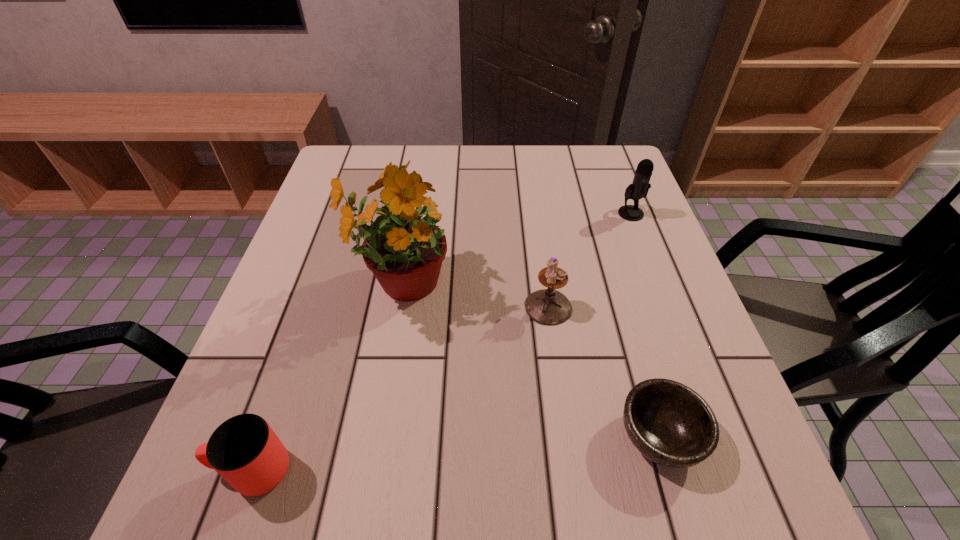
Where is `free space that satisfies the following two spatial constraints: 1. on the handle side of the leftmost object; 2. on the left side of the shortest object`? The image size is (960, 540). free space that satisfies the following two spatial constraints: 1. on the handle side of the leftmost object; 2. on the left side of the shortest object is located at coordinates (264, 436).

At what (x,y) coordinates should I click in order to perform the action: click on free location that satisfies the following two spatial constraints: 1. on the handle side of the candle holder; 2. on the left side of the cup. Please return your answer as a coordinate pair (x, y). Looking at the image, I should click on (309, 307).

At what (x,y) coordinates should I click in order to perform the action: click on vacant area that satisfies the following two spatial constraints: 1. on the handle side of the fourth tallest object; 2. on the right side of the flowerpot. Please return your answer as a coordinate pair (x, y). The image size is (960, 540). Looking at the image, I should click on pyautogui.click(x=317, y=285).

Locate an element on the screen. This screenshot has height=540, width=960. free space in the image that satisfies the following two spatial constraints: 1. on the handle side of the fourth tallest object; 2. on the left side of the third object from left to right is located at coordinates (309, 307).

Identify the location of free region that satisfies the following two spatial constraints: 1. on the back side of the shortest object; 2. on the left side of the microphone. This screenshot has height=540, width=960. (594, 213).